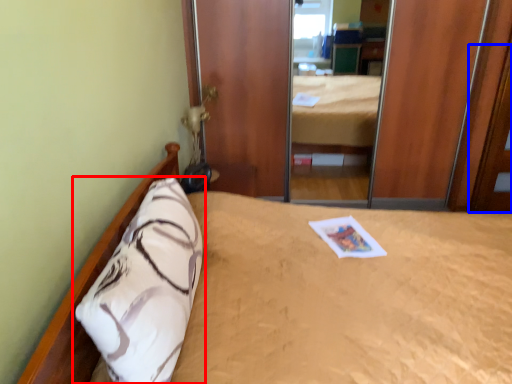
Question: Which point is further to the camera, pillow (highlighted by a red box) or door (highlighted by a blue box)?

Choices:
 (A) pillow
 (B) door

Answer: (B)